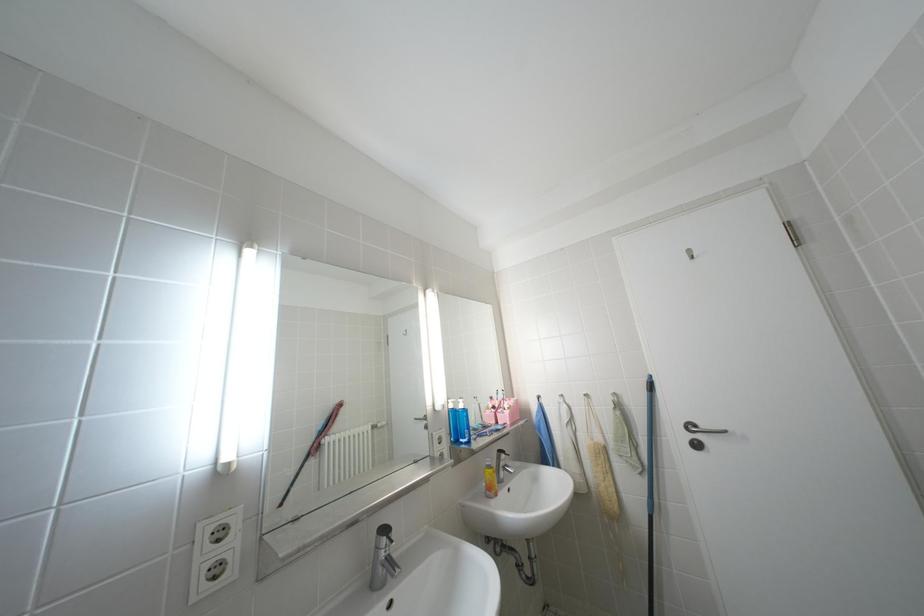
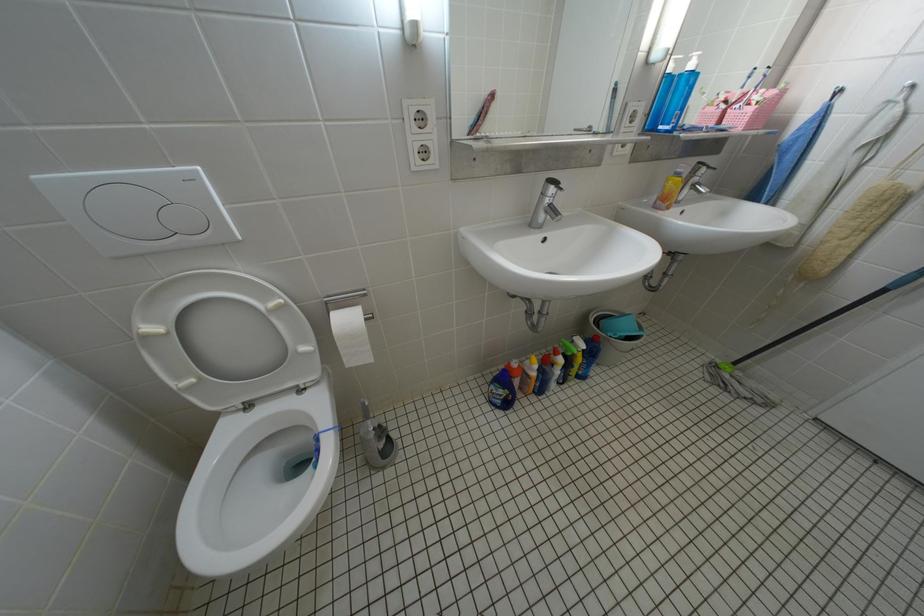
How did the camera likely rotate?

The camera's rotation is toward left-down.